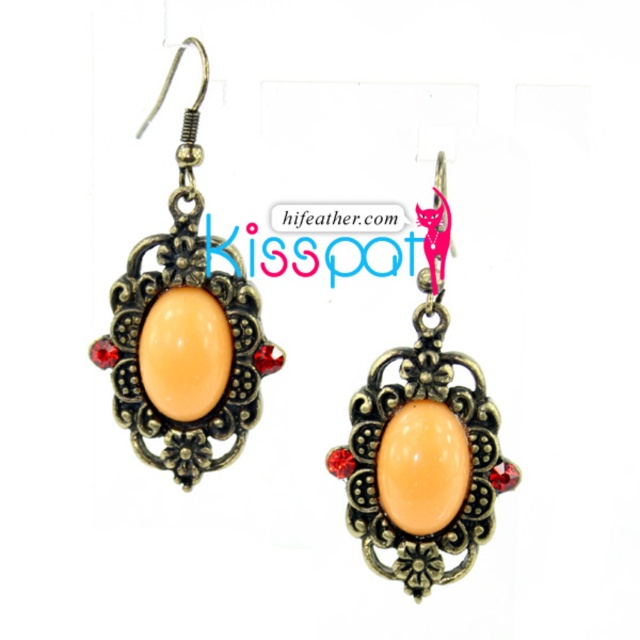
You are a jeweler examining the earrings. You need to determine if the matte orange stone at center will fit into a setting designed for the matte gold earring at center. Based on their sizes, what do you conclude?

The matte orange stone at center is larger in size than the matte gold earring at center, so it will not fit into a setting designed for the matte gold earring at center.

You are a jeweler who needs to ensure the spacing between the matte orange stone at center and the matte gold earring at center meets the safety standard of at least 8 inches. Based on the image, does the spacing between them meet the requirement?

The distance between the matte orange stone at center and the matte gold earring at center is 7.99 inches, which is just below the required 8 inches. Therefore, the spacing does not meet the safety standard.